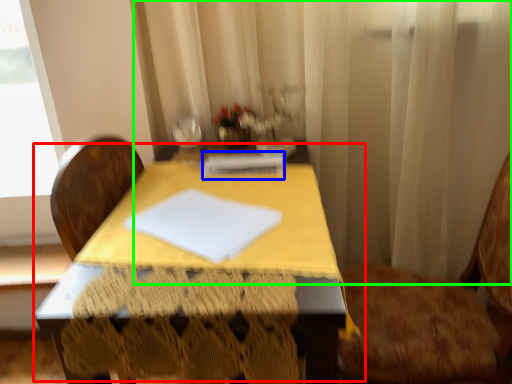
Question: Estimate the real-world distances between objects in this image. Which object is closer to table (highlighted by a red box), notebook (highlighted by a blue box) or curtain (highlighted by a green box)?

Choices:
 (A) notebook
 (B) curtain

Answer: (A)